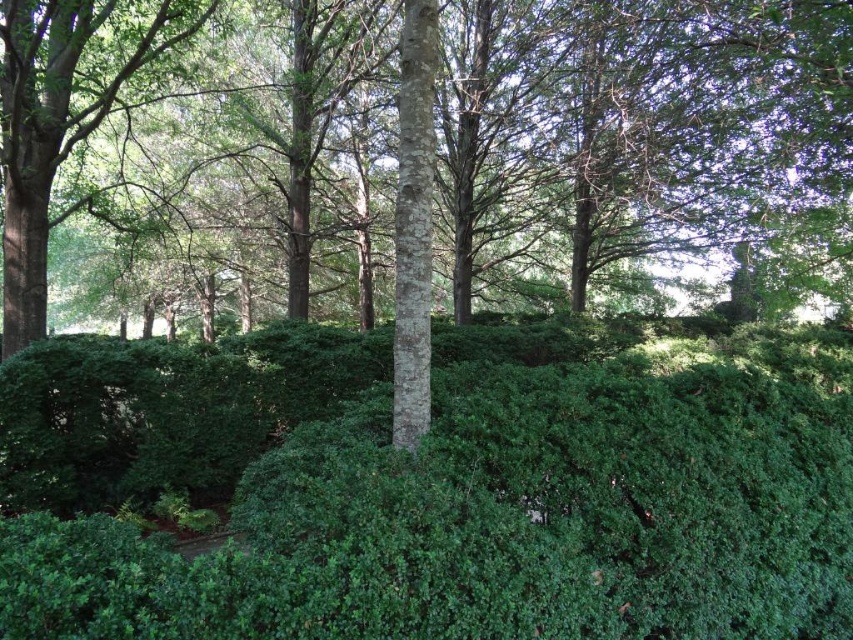
Question: Which object is positioned farthest from the green leafy hedge at center?

Choices:
 (A) green leafy tree at left
 (B) smooth bark tree at center

Answer: (B)

Question: Does smooth bark tree at center appear on the left side of green leafy tree at left?

Choices:
 (A) no
 (B) yes

Answer: (A)

Question: Estimate the real-world distances between objects in this image. Which object is closer to the smooth bark tree at center?

Choices:
 (A) green leafy hedge at center
 (B) green leafy tree at left

Answer: (B)

Question: Can you confirm if green leafy hedge at center is positioned below green leafy tree at left?

Choices:
 (A) no
 (B) yes

Answer: (B)

Question: Is green leafy hedge at center wider than smooth bark tree at center?

Choices:
 (A) no
 (B) yes

Answer: (A)

Question: Which of these objects is positioned closest to the green leafy hedge at center?

Choices:
 (A) green leafy tree at left
 (B) smooth bark tree at center

Answer: (A)